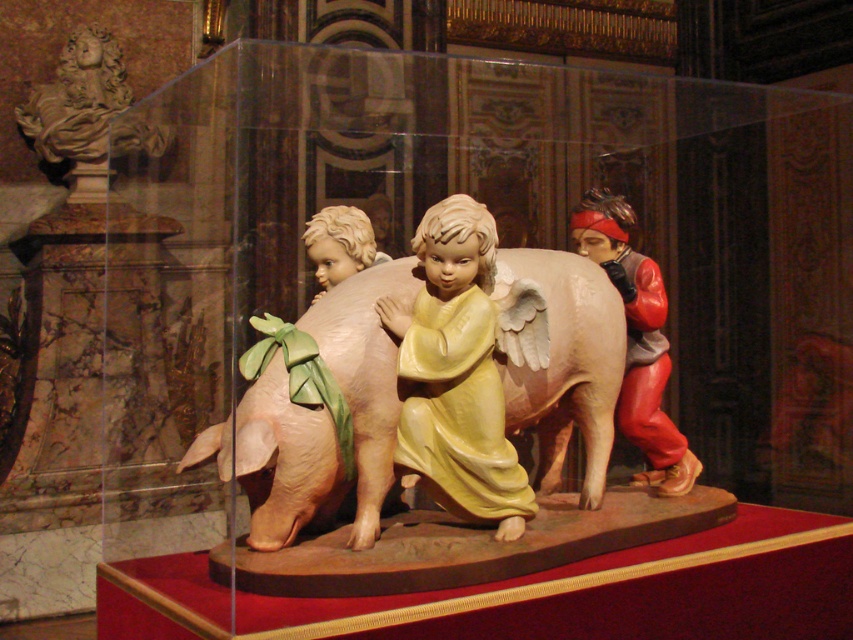
Question: Can you confirm if matte red cloth at right is smaller than smooth beige pig at center?

Choices:
 (A) yes
 (B) no

Answer: (B)

Question: Considering the real-world distances, which object is closest to the matte yellow angel at center?

Choices:
 (A) matte pink pig at center
 (B) matte red cloth at right
 (C) smooth beige pig at center

Answer: (A)

Question: Is matte pink pig at center above smooth beige pig at center?

Choices:
 (A) no
 (B) yes

Answer: (A)

Question: Which of the following is the closest to the observer?

Choices:
 (A) matte red cloth at right
 (B) matte pink pig at center

Answer: (B)

Question: Which of the following is the closest to the observer?

Choices:
 (A) (x=669, y=483)
 (B) (x=339, y=208)
 (C) (x=289, y=532)
 (D) (x=473, y=452)

Answer: (C)

Question: Does matte red cloth at right appear on the right side of smooth beige pig at center?

Choices:
 (A) yes
 (B) no

Answer: (A)